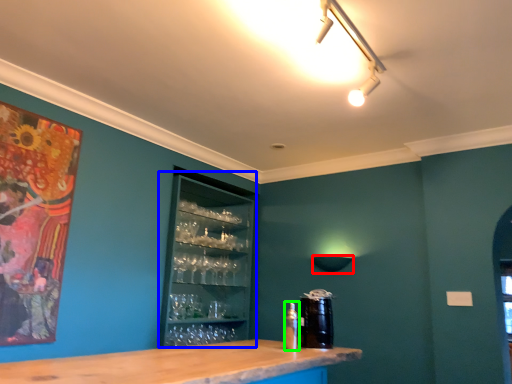
Question: Based on their relative distances, which object is farther from lamp (highlighted by a red box)? Choose from drink (highlighted by a blue box) and bottle (highlighted by a green box).

Choices:
 (A) drink
 (B) bottle

Answer: (B)